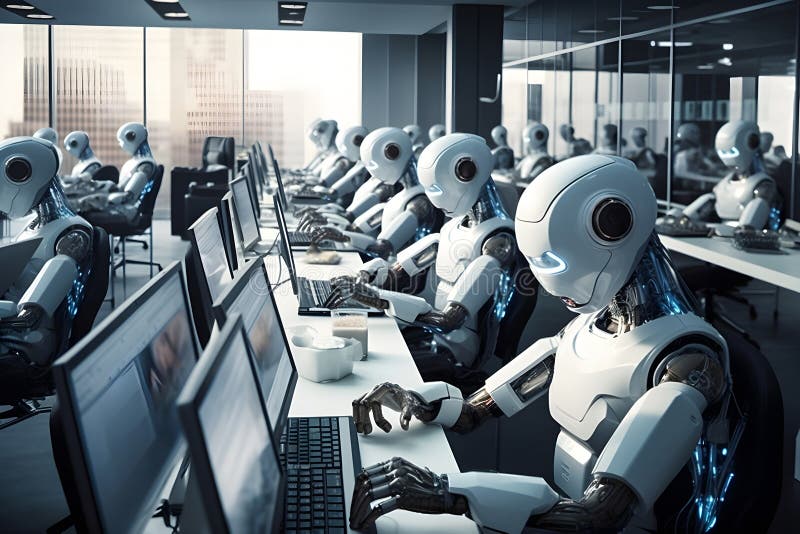
The width and height of the screenshot is (800, 534). In order to click on office chairs in this screenshot , I will do `click(750, 420)`, `click(525, 311)`, `click(96, 292)`, `click(142, 204)`, `click(106, 171)`, `click(784, 203)`.